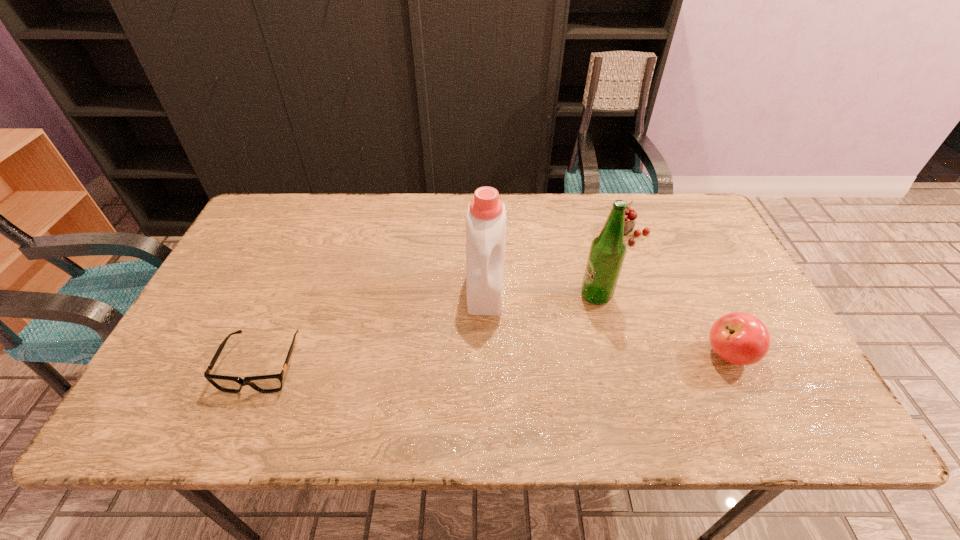
Where is `vacant space located on the handle side of the farthest object`? vacant space located on the handle side of the farthest object is located at coordinates (552, 290).

The height and width of the screenshot is (540, 960). What are the coordinates of `free location located on the handle side of the second object from left to right` in the screenshot? It's located at (483, 368).

This screenshot has height=540, width=960. In order to click on vacant space located on the handle side of the second object from left to right in this screenshot , I will do `click(485, 333)`.

The image size is (960, 540). In order to click on vacant space situated on the handle side of the second object from left to right in this screenshot , I will do `click(484, 336)`.

Where is `free spot located 0.060m on the label of the beer bottle`? The height and width of the screenshot is (540, 960). free spot located 0.060m on the label of the beer bottle is located at coordinates (575, 318).

Locate an element on the screen. vacant area situated on the label of the beer bottle is located at coordinates (542, 352).

The height and width of the screenshot is (540, 960). Find the location of `vacant space located on the label of the beer bottle`. vacant space located on the label of the beer bottle is located at coordinates (514, 382).

Where is `object positioned at the far edge`? object positioned at the far edge is located at coordinates (630, 214).

Locate an element on the screen. sunglasses that is positioned at the near edge is located at coordinates (272, 383).

This screenshot has height=540, width=960. Identify the location of apple located in the near edge section of the desktop. (740, 338).